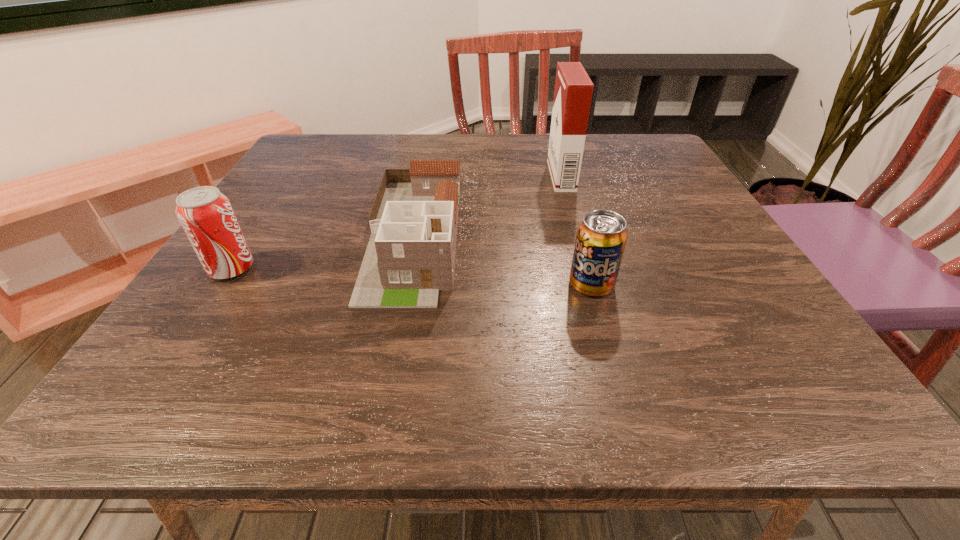
Identify the location of object at the far edge. This screenshot has width=960, height=540. coord(573,91).

Locate an element on the screen. object that is at the left edge is located at coordinates (206, 215).

You are a GUI agent. You are given a task and a screenshot of the screen. Output one action in this format:
    pyautogui.click(x=<x>, y=<y>)
    Task: Click on the free space at the near edge of the desktop
    Image resolution: width=960 pixels, height=540 pixels.
    Given the screenshot: What is the action you would take?
    pyautogui.click(x=606, y=368)

Locate an element on the screen. The height and width of the screenshot is (540, 960). free spot at the left edge of the desktop is located at coordinates (232, 284).

Where is `vacant space at the right edge of the desktop`? The image size is (960, 540). vacant space at the right edge of the desktop is located at coordinates (715, 219).

At what (x,y) coordinates should I click in order to perform the action: click on free spot at the far left corner of the desktop. Please return your answer as a coordinate pair (x, y). This screenshot has width=960, height=540. Looking at the image, I should click on (336, 150).

Identify the location of blank space at the far right corner of the desktop. This screenshot has height=540, width=960. (631, 138).

This screenshot has width=960, height=540. I want to click on free space between the third object from right to left and the left soda can, so click(x=324, y=252).

At what (x,y) coordinates should I click in order to perform the action: click on free space between the dollhouse and the left soda can. Please return your answer as a coordinate pair (x, y). Looking at the image, I should click on (324, 252).

I want to click on vacant point located between the dollhouse and the leftmost object, so click(x=324, y=252).